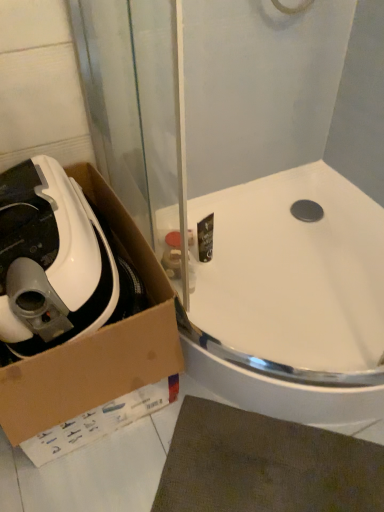
Question: From the image's perspective, is cardboard box at lower left beneath white glossy sink at upper center?

Choices:
 (A) yes
 (B) no

Answer: (A)

Question: From a real-world perspective, is cardboard box at lower left on top of white glossy sink at upper center?

Choices:
 (A) no
 (B) yes

Answer: (B)

Question: Can you confirm if cardboard box at lower left is taller than white glossy sink at upper center?

Choices:
 (A) yes
 (B) no

Answer: (A)

Question: Does cardboard box at lower left have a lesser width compared to white glossy sink at upper center?

Choices:
 (A) no
 (B) yes

Answer: (B)

Question: Is white glossy sink at upper center a part of cardboard box at lower left?

Choices:
 (A) yes
 (B) no

Answer: (B)

Question: Does cardboard box at lower left turn towards white glossy sink at upper center?

Choices:
 (A) yes
 (B) no

Answer: (B)

Question: Does cardboard box at lower left come behind white matte vacuum cleaner at left?

Choices:
 (A) yes
 (B) no

Answer: (B)

Question: Does cardboard box at lower left appear on the left side of white matte vacuum cleaner at left?

Choices:
 (A) no
 (B) yes

Answer: (A)

Question: Is cardboard box at lower left closer to the viewer compared to white matte vacuum cleaner at left?

Choices:
 (A) no
 (B) yes

Answer: (B)

Question: Can you confirm if cardboard box at lower left is thinner than white matte vacuum cleaner at left?

Choices:
 (A) yes
 (B) no

Answer: (B)

Question: Would you say cardboard box at lower left contains white matte vacuum cleaner at left?

Choices:
 (A) no
 (B) yes

Answer: (B)

Question: From the image's perspective, is cardboard box at lower left on top of white matte vacuum cleaner at left?

Choices:
 (A) no
 (B) yes

Answer: (A)

Question: Is white matte vacuum cleaner at left surrounding white glossy sink at upper center?

Choices:
 (A) no
 (B) yes

Answer: (A)